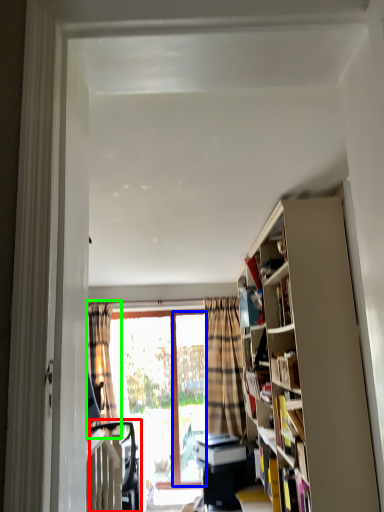
Question: Estimate the real-world distances between objects in this image. Which object is farther from swivel chair (highlighted by a red box), screen door (highlighted by a blue box) or curtain (highlighted by a green box)?

Choices:
 (A) screen door
 (B) curtain

Answer: (A)